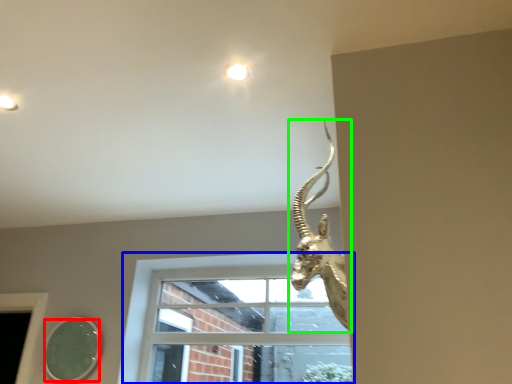
Question: Considering the real-world distances, which object is farthest from mirror (highlighted by a red box)? window (highlighted by a blue box) or animal (highlighted by a green box)?

Choices:
 (A) window
 (B) animal

Answer: (B)